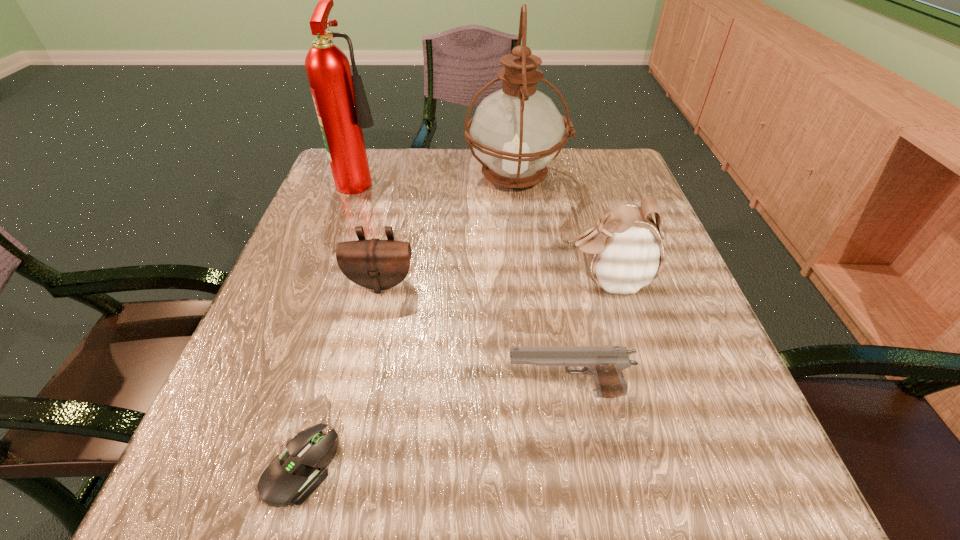
Where is `vacant region located on the front-facing side of the taller pouch`? Image resolution: width=960 pixels, height=540 pixels. vacant region located on the front-facing side of the taller pouch is located at coordinates (371, 281).

Where is `free space located 0.050m on the front-facing side of the taller pouch`? free space located 0.050m on the front-facing side of the taller pouch is located at coordinates (536, 281).

You are a GUI agent. You are given a task and a screenshot of the screen. Output one action in this format:
    pyautogui.click(x=<x>, y=<y>)
    Task: Click on the free space located on the front-facing side of the taller pouch
    This screenshot has height=540, width=960.
    Given the screenshot: What is the action you would take?
    pyautogui.click(x=503, y=281)

You are a GUI agent. You are given a task and a screenshot of the screen. Output one action in this format:
    pyautogui.click(x=<x>, y=<y>)
    Task: Click on the vacant space located 0.280m at the barrel of the pistol
    This screenshot has width=960, height=540.
    Given the screenshot: What is the action you would take?
    pyautogui.click(x=313, y=393)

Locate an element on the screen. vacant space located 0.130m at the barrel of the pistol is located at coordinates (417, 393).

You are a GUI agent. You are given a task and a screenshot of the screen. Output one action in this format:
    pyautogui.click(x=<x>, y=<y>)
    Task: Click on the vacant space located 0.140m at the barrel of the pistol
    The width and height of the screenshot is (960, 540).
    Given the screenshot: What is the action you would take?
    pyautogui.click(x=410, y=393)

The height and width of the screenshot is (540, 960). What are the coordinates of `free space located with the flap open on the left pouch` in the screenshot? It's located at [366, 346].

This screenshot has width=960, height=540. I want to click on blank area located 0.280m on the back of the computer mouse, so click(x=353, y=283).

Where is `oil lamp that is at the far edge`? The width and height of the screenshot is (960, 540). oil lamp that is at the far edge is located at coordinates (517, 131).

You are a GUI agent. You are given a task and a screenshot of the screen. Output one action in this format:
    pyautogui.click(x=<x>, y=<y>)
    Task: Click on the fire extinguisher located in the far edge section of the desktop
    This screenshot has height=540, width=960.
    Given the screenshot: What is the action you would take?
    pyautogui.click(x=340, y=100)